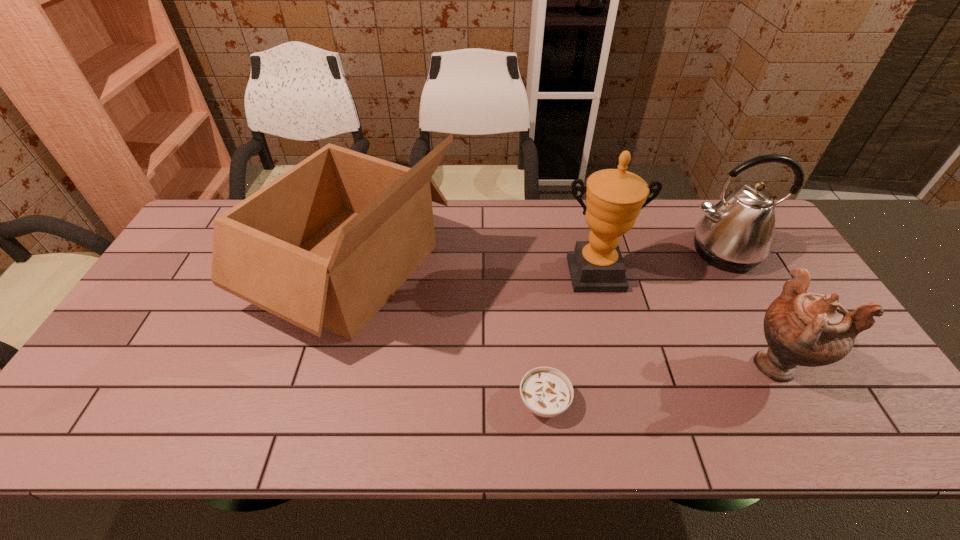
This screenshot has height=540, width=960. What are the coordinates of `box` in the screenshot? It's located at [x=326, y=244].

Locate an element on the screen. The width and height of the screenshot is (960, 540). the third object from left to right is located at coordinates (614, 197).

At what (x,y) coordinates should I click in order to perform the action: click on kettle. Please return your answer as a coordinate pair (x, y). This screenshot has height=540, width=960. Looking at the image, I should click on (737, 234).

Find the location of a particular element. urn is located at coordinates (801, 328).

This screenshot has height=540, width=960. Find the location of `the second object from left to right`. the second object from left to right is located at coordinates (547, 392).

The image size is (960, 540). I want to click on soup bowl, so click(547, 392).

Where is `vacant region located on the right of the leftmost object`? vacant region located on the right of the leftmost object is located at coordinates (514, 268).

The height and width of the screenshot is (540, 960). In order to click on vacant space located at the front of the third object from right to left with handles in this screenshot , I will do `click(627, 404)`.

This screenshot has height=540, width=960. I want to click on vacant space located 0.190m from the spout of the kettle, so click(766, 328).

Where is `vacant space located on the left of the urn`? vacant space located on the left of the urn is located at coordinates (579, 364).